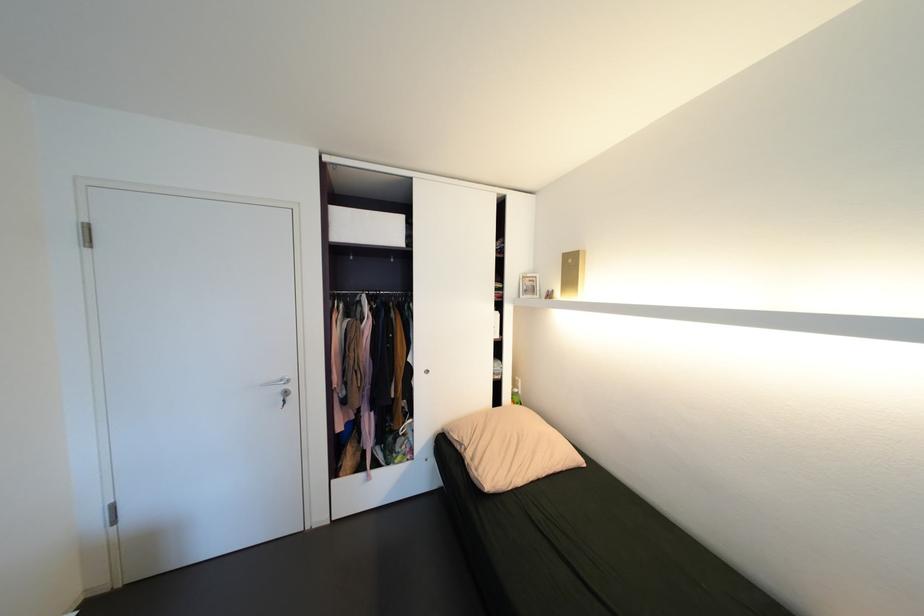
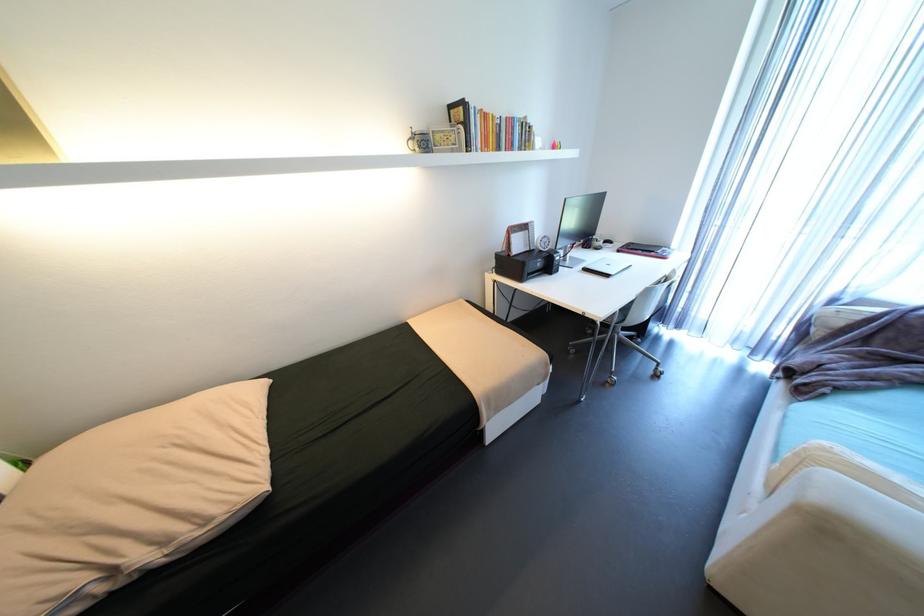
How did the camera likely rotate?

The camera rotated toward right-down.